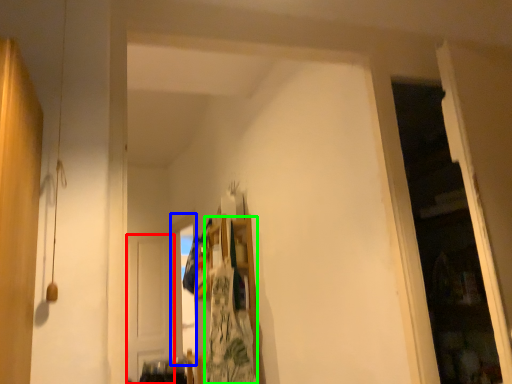
Question: Based on their relative distances, which object is farther from door (highlighted by a red box)? Choose from window (highlighted by a blue box) and laundry (highlighted by a green box).

Choices:
 (A) window
 (B) laundry

Answer: (B)